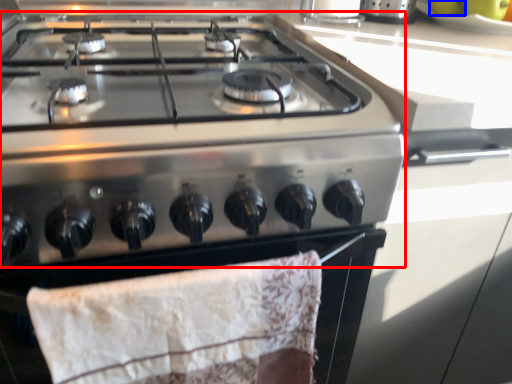
Question: Which point is further to the camera, gas stove (highlighted by a red box) or fruit (highlighted by a blue box)?

Choices:
 (A) gas stove
 (B) fruit

Answer: (B)